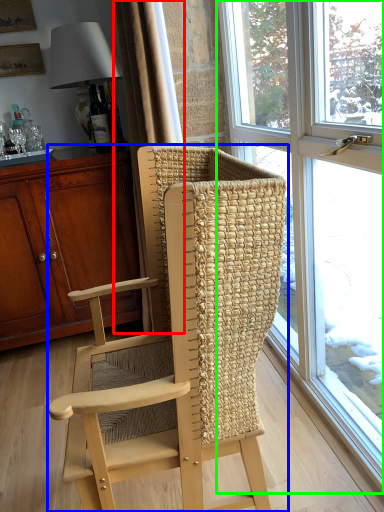
Question: Based on their relative distances, which object is farther from curtain (highlighted by a red box)? Choose from chair (highlighted by a blue box) and window (highlighted by a green box).

Choices:
 (A) chair
 (B) window

Answer: (B)